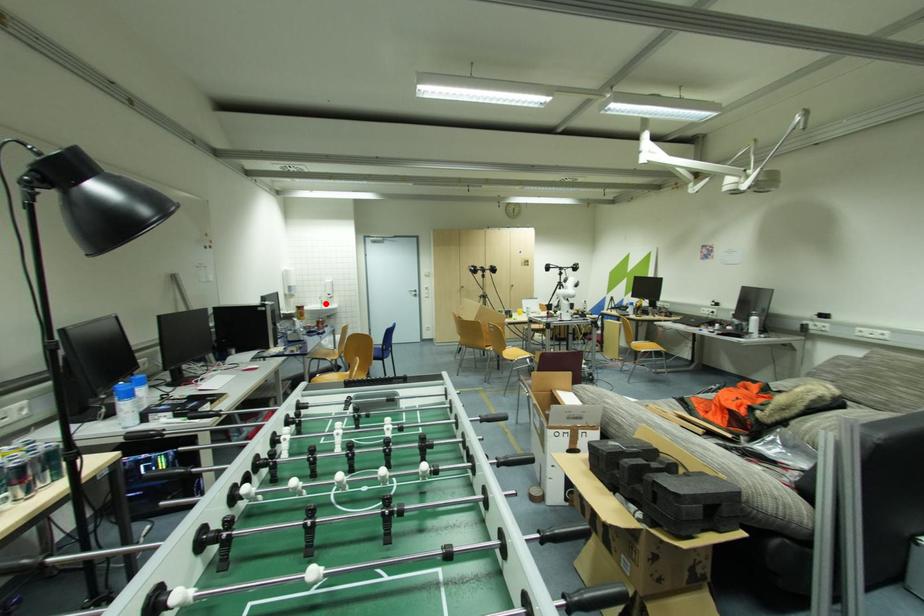
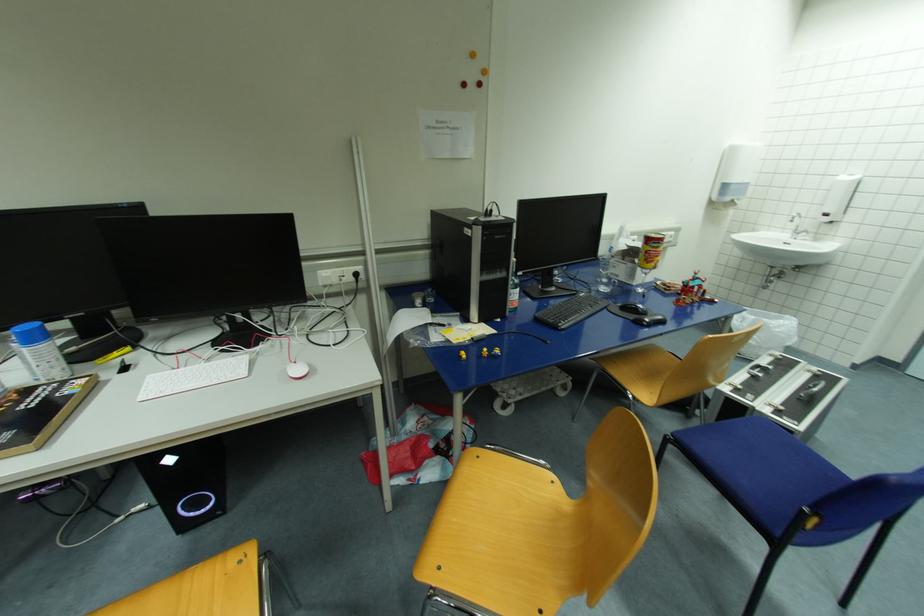
In the second image, find the point that corresponds to the highlighted location in the first image.

(799, 233)